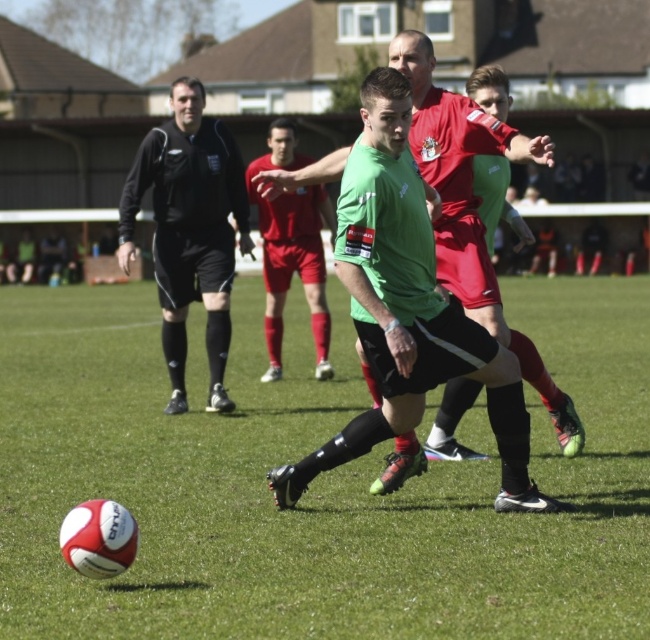
Question: Which point is closer to the camera?

Choices:
 (A) black smooth shirt at upper left
 (B) red matte soccer player at center
 (C) green matte jersey at center
 (D) white textured ball at lower left

Answer: (D)

Question: Which object appears farthest from the camera in this image?

Choices:
 (A) green matte jersey at center
 (B) white textured ball at lower left
 (C) red matte soccer player at center

Answer: (C)

Question: Estimate the real-world distances between objects in this image. Which object is farther from the green matte jersey at center?

Choices:
 (A) red matte soccer player at center
 (B) black smooth shirt at upper left

Answer: (A)

Question: Can you confirm if green matte jersey at center is positioned below red matte soccer player at center?

Choices:
 (A) no
 (B) yes

Answer: (B)

Question: Is black smooth shirt at upper left to the left of red matte soccer player at center from the viewer's perspective?

Choices:
 (A) no
 (B) yes

Answer: (B)

Question: Is white textured ball at lower left closer to camera compared to black smooth shirt at upper left?

Choices:
 (A) no
 (B) yes

Answer: (B)